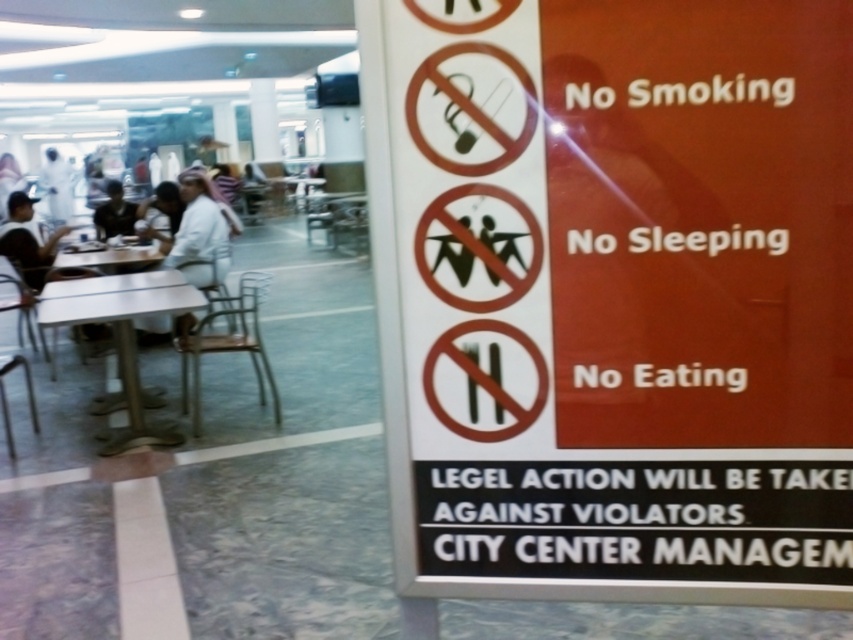
Which of these two, orange matte sign at right or white plastic table at center, stands shorter?

white plastic table at center

Between orange matte sign at right and white plastic table at center, which one appears on the right side from the viewer's perspective?

Positioned to the right is orange matte sign at right.

Is point (843, 522) positioned behind point (132, 253)?

No, it is in front of (132, 253).

You are a GUI agent. You are given a task and a screenshot of the screen. Output one action in this format:
    pyautogui.click(x=<x>, y=<y>)
    Task: Click on the orange matte sign at right
    Image resolution: width=853 pixels, height=640 pixels.
    Given the screenshot: What is the action you would take?
    pyautogui.click(x=614, y=296)

Can you confirm if orange matte sign at right is wider than light blue fabric shirt at left?

In fact, orange matte sign at right might be narrower than light blue fabric shirt at left.

Does orange matte sign at right appear over light blue fabric shirt at left?

Actually, orange matte sign at right is below light blue fabric shirt at left.

Is point (712, 205) closer to camera compared to point (96, 236)?

Yes, it is in front of point (96, 236).

The image size is (853, 640). In order to click on orange matte sign at right in this screenshot , I will do `click(614, 296)`.

Does white glossy table at center appear under white plastic table at center?

Indeed, white glossy table at center is positioned under white plastic table at center.

Looking at this image, which is below, white glossy table at center or white plastic table at center?

white glossy table at center is below.

Does point (125, 372) come closer to viewer compared to point (163, 250)?

Yes.

Find the location of a particular element. white glossy table at center is located at coordinates (122, 333).